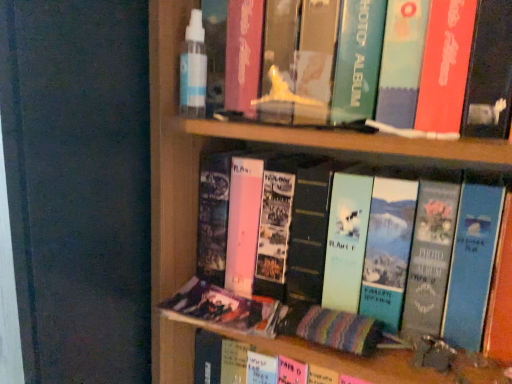
Question: Is matte green photo album at center, placed as the first book when sorted from top to bottom, wider or thinner than matte plastic photo album at lower center, the second book from the top?

Choices:
 (A) wide
 (B) thin

Answer: (A)

Question: From their relative heights in the image, would you say matte green photo album at center, placed as the first book when sorted from top to bottom, is taller or shorter than matte plastic photo album at lower center, which ranks as the 1th book in bottom-to-top order?

Choices:
 (A) tall
 (B) short

Answer: (A)

Question: Is matte green photo album at center, placed as the first book when sorted from top to bottom, situated inside matte plastic photo album at lower center, which ranks as the 1th book in bottom-to-top order, or outside?

Choices:
 (A) outside
 (B) inside

Answer: (A)

Question: From a real-world perspective, is matte plastic photo album at lower center, the second book from the top, positioned above or below matte green photo album at center, the 2th book ordered from the bottom?

Choices:
 (A) below
 (B) above

Answer: (A)

Question: Which is correct: matte plastic photo album at lower center, which ranks as the 1th book in bottom-to-top order, is inside matte green photo album at center, the 2th book ordered from the bottom, or outside of it?

Choices:
 (A) inside
 (B) outside

Answer: (B)

Question: Is matte plastic photo album at lower center, the second book from the top, in front of or behind matte green photo album at center, the 2th book ordered from the bottom, in the image?

Choices:
 (A) front
 (B) behind

Answer: (B)

Question: Visually, is matte plastic photo album at lower center, the second book from the top, positioned to the left or to the right of matte green photo album at center, the 2th book ordered from the bottom?

Choices:
 (A) left
 (B) right

Answer: (A)